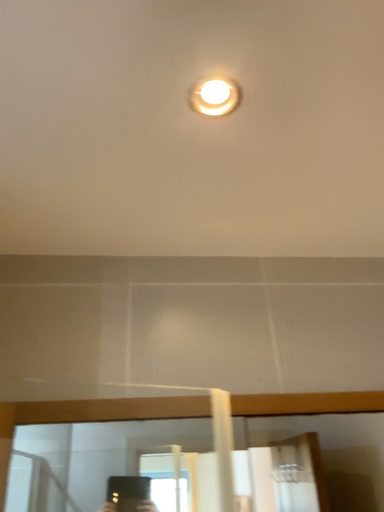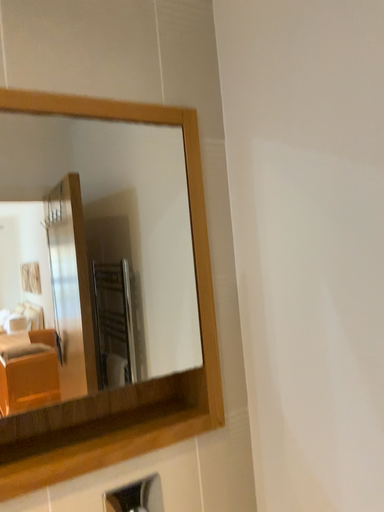
Question: How did the camera likely rotate when shooting the video?

Choices:
 (A) rotated left
 (B) rotated right

Answer: (B)